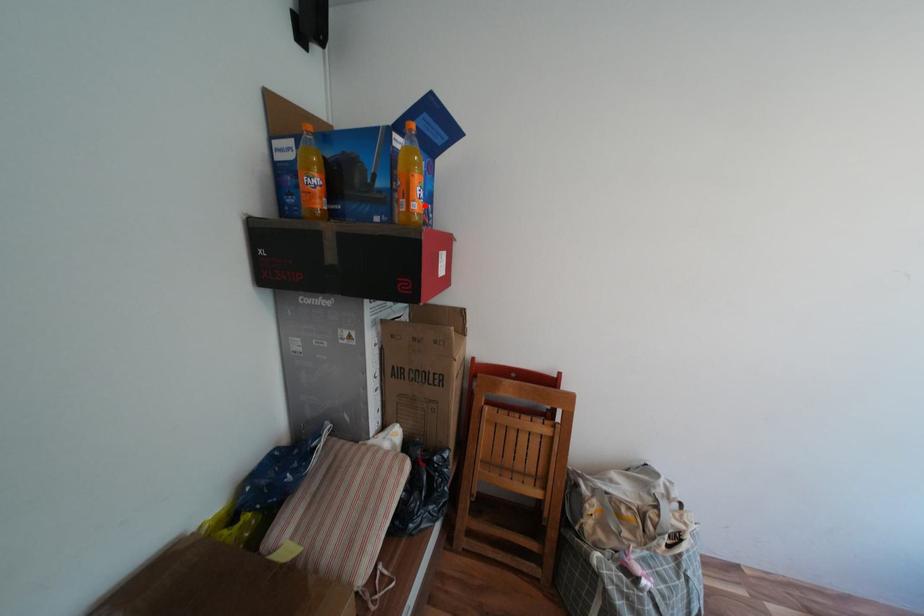
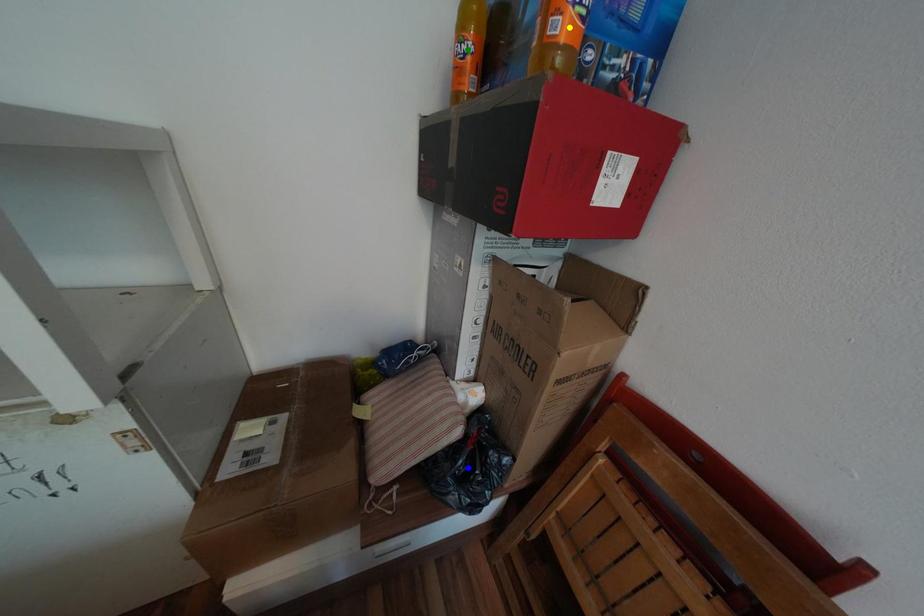
Question: I am providing you with two images of the same scene from different viewpoints. A red point is marked on the first image. You are given multiple points on the second image. Which point in image 2 is actually the same real-world point as the red point in image 1?

Choices:
 (A) green point
 (B) blue point
 (C) yellow point

Answer: (C)